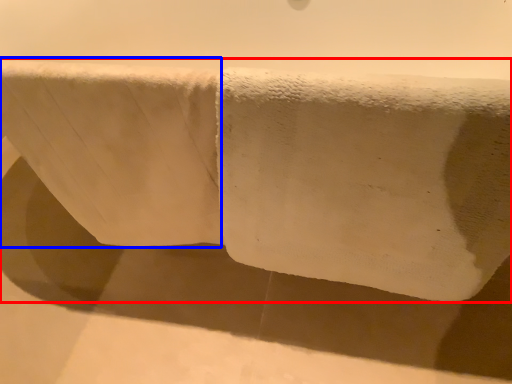
Question: Which point is closer to the camera, towel (highlighted by a red box) or bath towel (highlighted by a blue box)?

Choices:
 (A) towel
 (B) bath towel

Answer: (A)